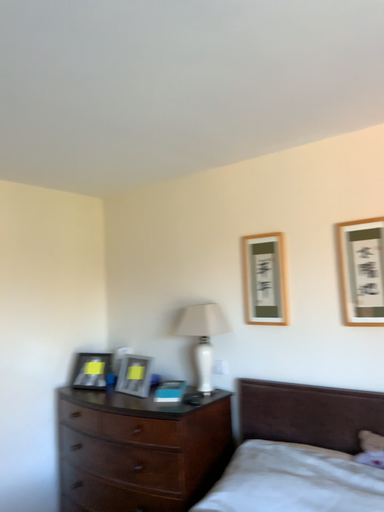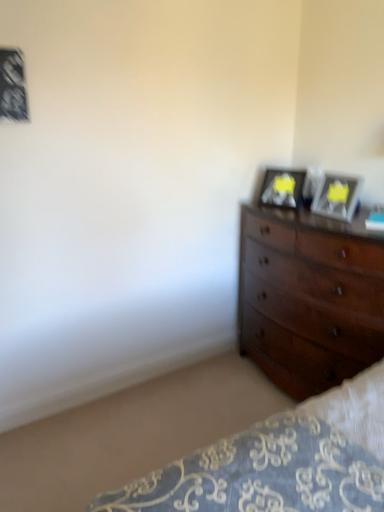
Question: Which way did the camera rotate in the video?

Choices:
 (A) rotated downward
 (B) rotated upward

Answer: (A)